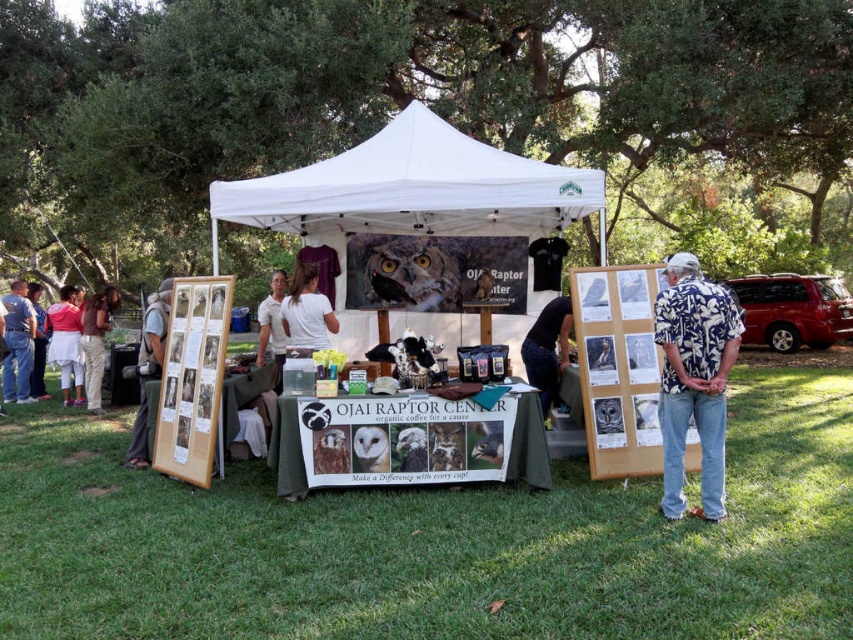
Question: Estimate the real-world distances between objects in this image. Which object is farther from the white fabric canopy at center?

Choices:
 (A) blue floral shirt at center
 (B) green grass at lower center

Answer: (B)

Question: In this image, where is green grass at lower center located relative to brown cotton shirt at left?

Choices:
 (A) above
 (B) below

Answer: (B)

Question: Among these objects, which one is farthest from the camera?

Choices:
 (A) green grass at lower center
 (B) white cotton shorts at lower left
 (C) dark blue shirt at center

Answer: (B)

Question: Is dark blue shirt at center further to the viewer compared to white cotton shirt at center?

Choices:
 (A) yes
 (B) no

Answer: (B)

Question: Can you confirm if green grass at lower center is positioned to the right of white t-shirt at center?

Choices:
 (A) no
 (B) yes

Answer: (B)

Question: Which point is farther to the camera?

Choices:
 (A) (198, 545)
 (B) (32, 320)

Answer: (B)